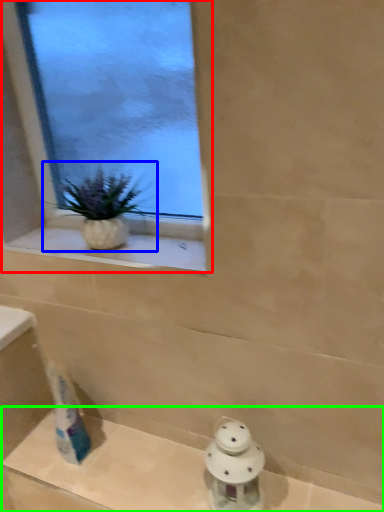
Question: Which is nearer to the window (highlighted by a red box)? houseplant (highlighted by a blue box) or bath (highlighted by a green box).

Choices:
 (A) houseplant
 (B) bath

Answer: (A)